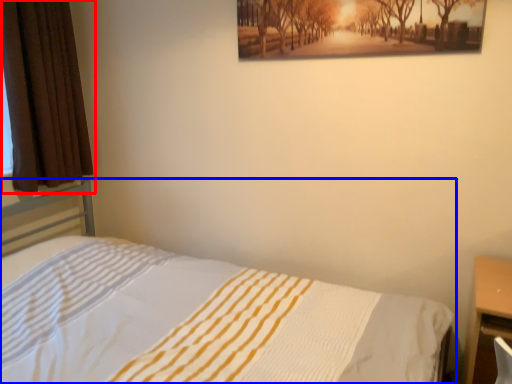
Question: Which point is closer to the camera, curtain (highlighted by a red box) or bed (highlighted by a blue box)?

Choices:
 (A) curtain
 (B) bed

Answer: (B)